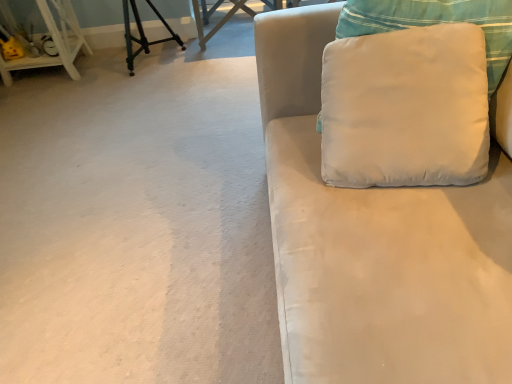
Question: Is satin white couch at right to the left or to the right of white fabric pillow at upper right in the image?

Choices:
 (A) left
 (B) right

Answer: (B)

Question: Considering the positions of satin white couch at right and white fabric pillow at upper right in the image, is satin white couch at right bigger or smaller than white fabric pillow at upper right?

Choices:
 (A) small
 (B) big

Answer: (B)

Question: Estimate the real-world distances between objects in this image. Which object is farther from the wooden table at upper center?

Choices:
 (A) white fabric pillow at upper right
 (B) satin white couch at right
 (C) white wood shelf at left

Answer: (B)

Question: Considering the real-world distances, which object is farthest from the wooden table at upper center?

Choices:
 (A) white fabric pillow at upper right
 (B) white wood shelf at left
 (C) satin white couch at right

Answer: (C)